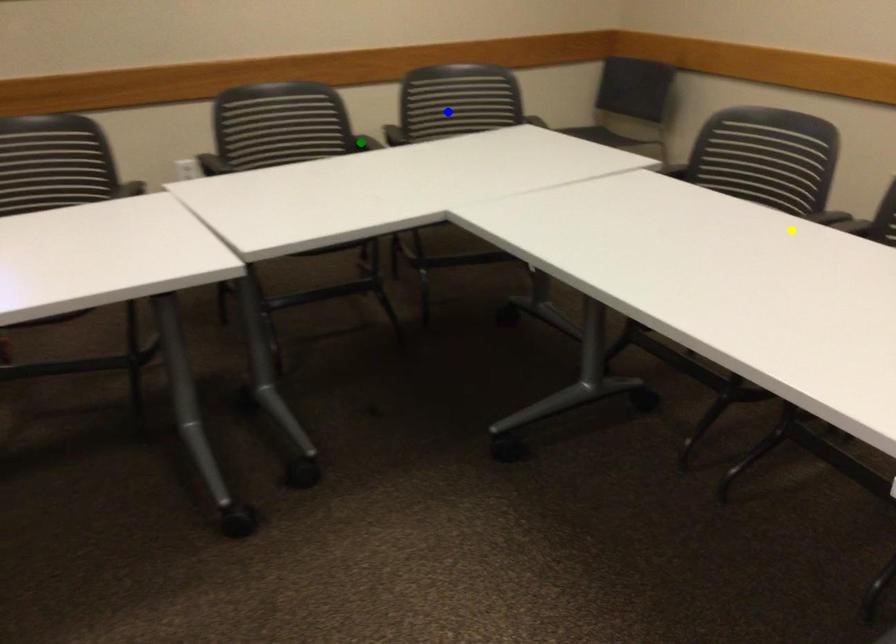
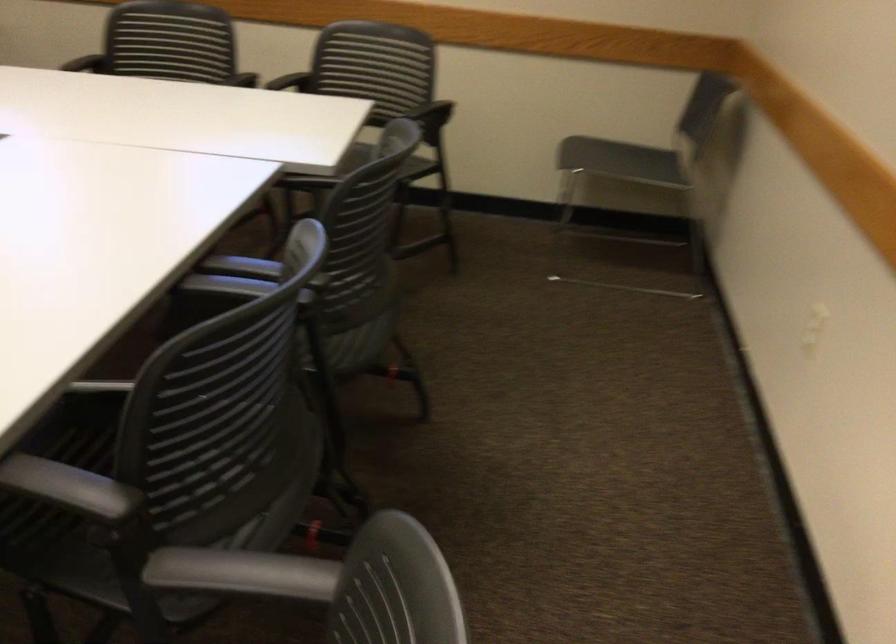
I am providing you with two images of the same scene from different viewpoints. Three points are marked in image1. Which point corresponds to a part or object that is occluded in image2?In image1, three points are marked. Which of them correspond to a part or object that is occluded in image2?Among the three points shown in image1, which one corresponds to a part or object that is no longer visible due to occlusion in image2?

green point